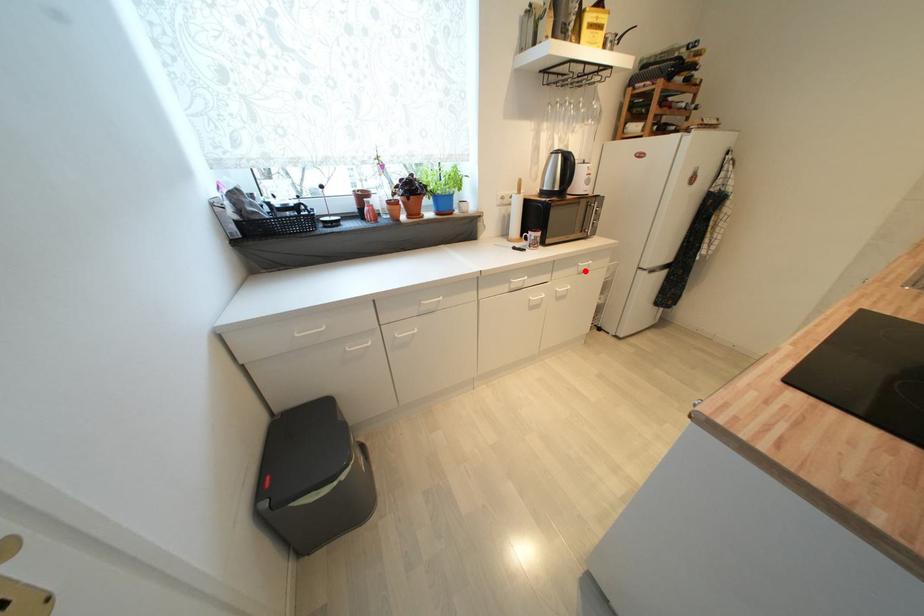
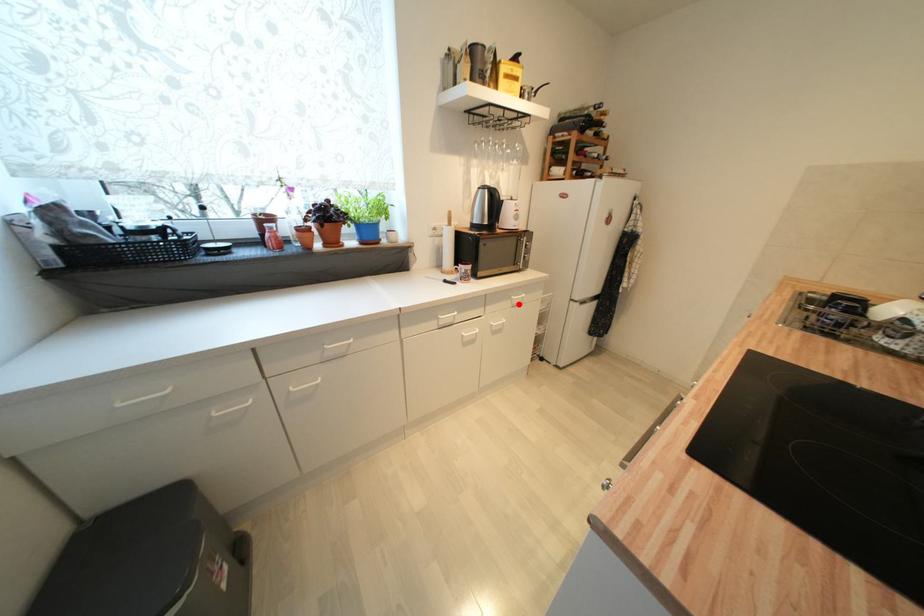
I am providing you with two images of the same scene from different viewpoints. A red point is marked on the first image and another point is marked on the second image. Is the red point in image1 aligned with the point shown in image2?

Yes